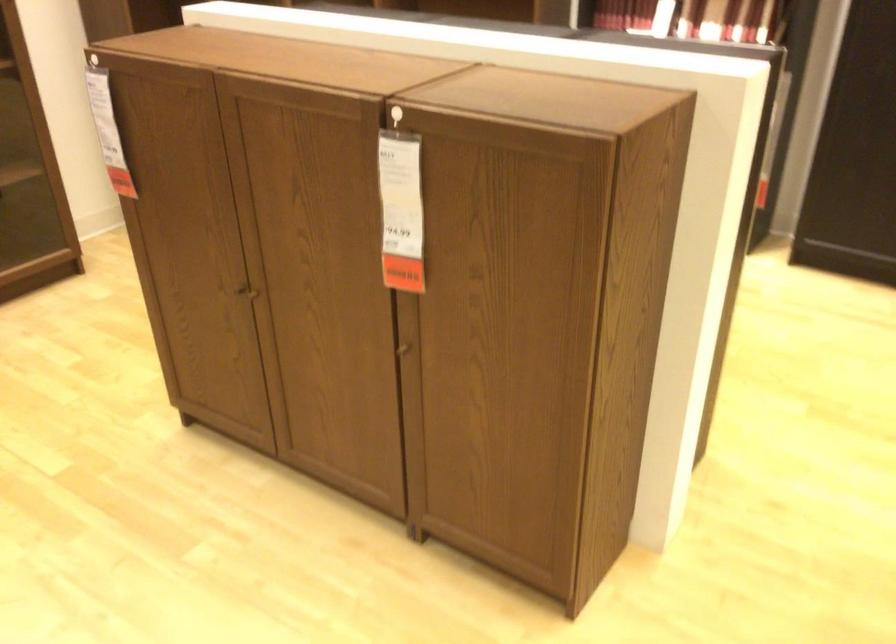
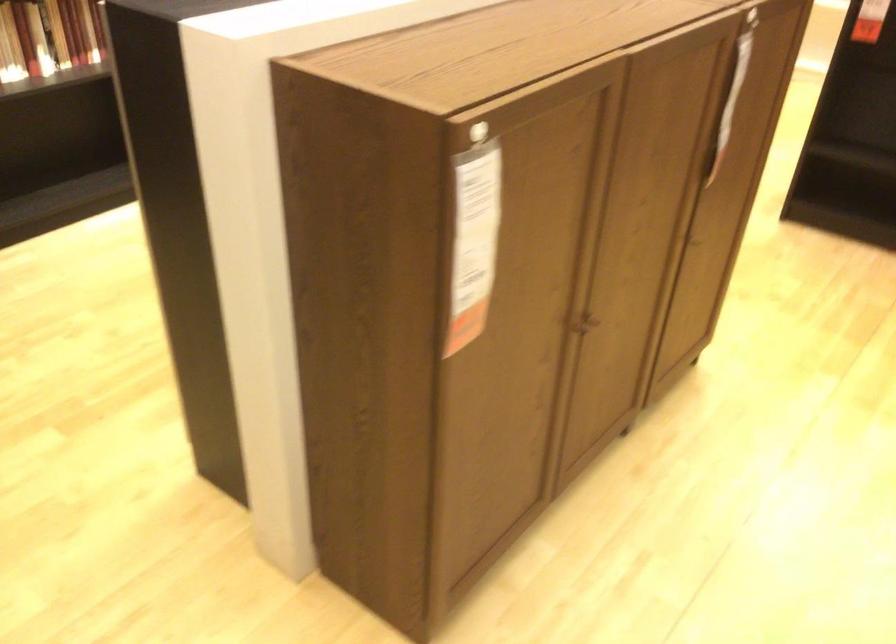
Where in the second image is the point corresponding to the point at 116,124 from the first image?

(474, 242)